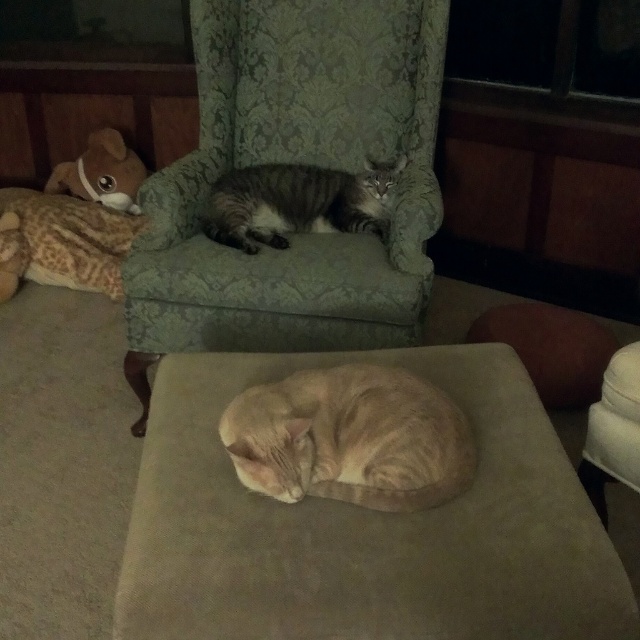
You are a robotic vacuum cleaner positioned at the origin point of the room. Your task is to move to the green damask armchair at upper center. According to the coordinates provided, what are the X and Y coordinates you need to navigate to?

The green damask armchair at upper center is located at coordinates X 0.253 and Y 0.467, so you should navigate to those coordinates to reach it.

You are a pet sitter who needs to place a new toy between the beige fabric cat at center and the soft plush dog at left. Considering their heights, which pet should the toy be placed closer to?

The beige fabric cat at center is much taller than the soft plush dog at left, so the toy should be placed closer to the soft plush dog at left to ensure it is visible to both pets.

You are a photographer trying to capture a closeup shot of the beige fabric cat at center. According to the coordinates provided, where should you position your camera to ensure the cat is centered in your frame?

The beige fabric cat at center is located at coordinates point (365, 525). To center it in your frame, position your camera so that the cat aligns with the center point of your viewfinder at those coordinates.